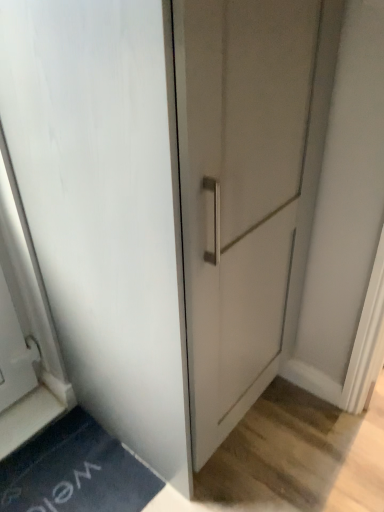
Question: Is dark blue rubber bath mat at lower left located outside white matte door at center?

Choices:
 (A) no
 (B) yes

Answer: (B)

Question: From a real-world perspective, is dark blue rubber bath mat at lower left below white matte door at center?

Choices:
 (A) no
 (B) yes

Answer: (B)

Question: Can you confirm if dark blue rubber bath mat at lower left is smaller than white matte door at center?

Choices:
 (A) no
 (B) yes

Answer: (B)

Question: Can you confirm if dark blue rubber bath mat at lower left is thinner than white matte door at center?

Choices:
 (A) no
 (B) yes

Answer: (B)

Question: Is dark blue rubber bath mat at lower left in front of white matte door at center?

Choices:
 (A) yes
 (B) no

Answer: (B)

Question: Would you say white matte door at center is part of dark blue rubber bath mat at lower left's contents?

Choices:
 (A) no
 (B) yes

Answer: (A)

Question: Would you say white matte door at center is a long distance from dark blue rubber bath mat at lower left?

Choices:
 (A) yes
 (B) no

Answer: (B)

Question: Considering the relative positions of white matte door at center and dark blue rubber bath mat at lower left in the image provided, is white matte door at center behind dark blue rubber bath mat at lower left?

Choices:
 (A) yes
 (B) no

Answer: (B)

Question: Is white matte door at center oriented towards dark blue rubber bath mat at lower left?

Choices:
 (A) no
 (B) yes

Answer: (A)

Question: Considering the relative sizes of white matte door at center and dark blue rubber bath mat at lower left in the image provided, is white matte door at center bigger than dark blue rubber bath mat at lower left?

Choices:
 (A) yes
 (B) no

Answer: (A)

Question: Considering the relative positions of white matte door at center and dark blue rubber bath mat at lower left in the image provided, is white matte door at center to the left of dark blue rubber bath mat at lower left from the viewer's perspective?

Choices:
 (A) no
 (B) yes

Answer: (A)

Question: Is white matte door at center smaller than dark blue rubber bath mat at lower left?

Choices:
 (A) yes
 (B) no

Answer: (B)

Question: Visually, is white matte door at center positioned to the left or to the right of dark blue rubber bath mat at lower left?

Choices:
 (A) right
 (B) left

Answer: (A)